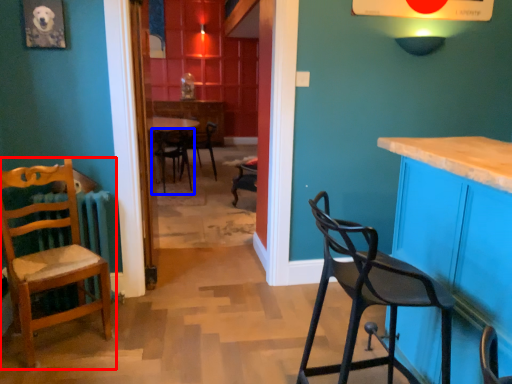
Question: Among these objects, which one is farthest to the camera, chair (highlighted by a red box) or chair (highlighted by a blue box)?

Choices:
 (A) chair
 (B) chair

Answer: (B)